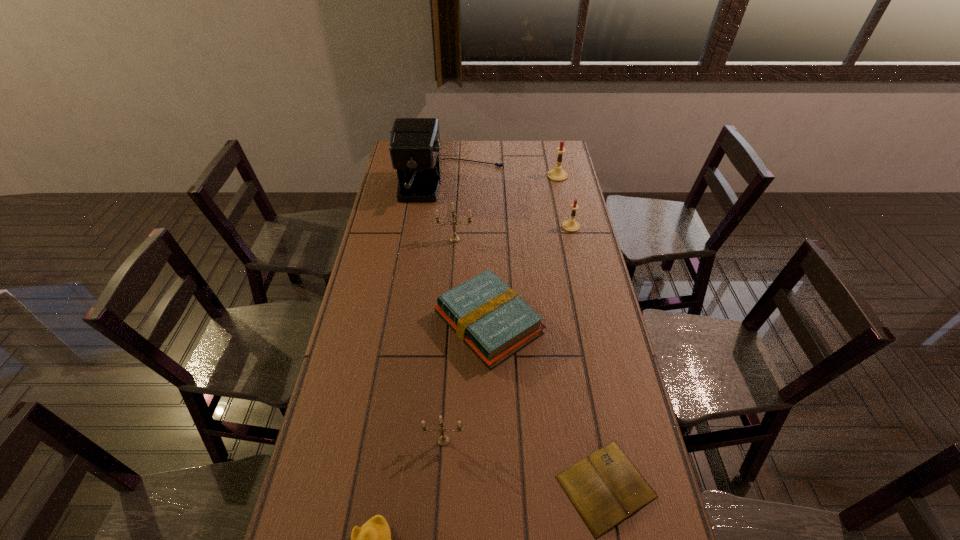
I want to click on free space that is in between the farther metallic candle and the bigger red candle, so click(x=506, y=207).

Where is `free area in between the black coffee maker and the fifth farthest object`? This screenshot has height=540, width=960. free area in between the black coffee maker and the fifth farthest object is located at coordinates (470, 254).

Locate which object is the fourth closest to the book. Please provide its 2D coordinates. Your answer should be formatted as a tuple, i.e. [(x, y)], where the tuple contains the x and y coordinates of a point satisfying the conditions above.

[(454, 238)]

You are a GUI agent. You are given a task and a screenshot of the screen. Output one action in this format:
    pyautogui.click(x=<x>, y=<y>)
    Task: Click on the object that stands as the second closest to the bigger metallic candle
    Image resolution: width=960 pixels, height=540 pixels.
    Given the screenshot: What is the action you would take?
    pyautogui.click(x=488, y=316)

Point out which candle is positioned as the second nearest to the book. Please provide its 2D coordinates. Your answer should be formatted as a tuple, i.e. [(x, y)], where the tuple contains the x and y coordinates of a point satisfying the conditions above.

[(454, 238)]

Identify which candle is the third closest to the shortest object. Please provide its 2D coordinates. Your answer should be formatted as a tuple, i.e. [(x, y)], where the tuple contains the x and y coordinates of a point satisfying the conditions above.

[(571, 225)]

The width and height of the screenshot is (960, 540). I want to click on blank space that satisfies the following two spatial constraints: 1. on the front-facing side of the bigger metallic candle; 2. on the right side of the tallest object, so click(x=447, y=239).

The height and width of the screenshot is (540, 960). I want to click on vacant point that satisfies the following two spatial constraints: 1. on the front-facing side of the nearest candle; 2. on the right side of the coffee maker, so 431,441.